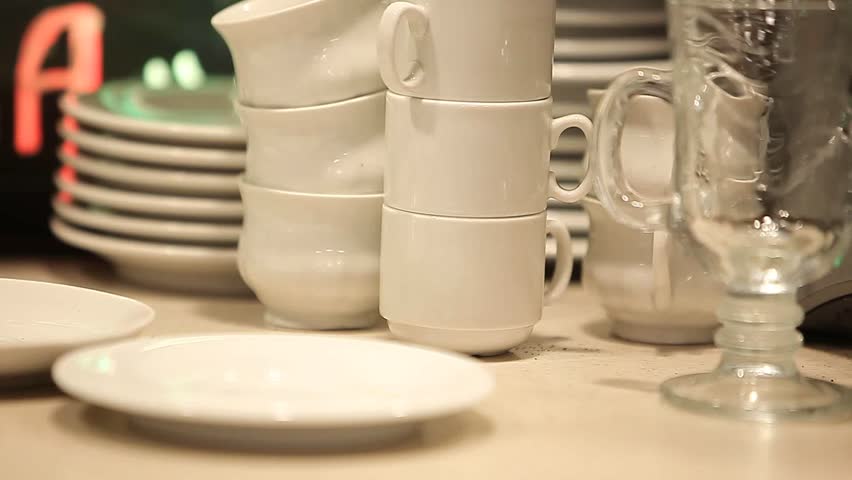
Where is `mugs`? This screenshot has height=480, width=852. mugs is located at coordinates (281, 51), (463, 54), (468, 147), (331, 151), (321, 250), (487, 302), (624, 273), (643, 145).